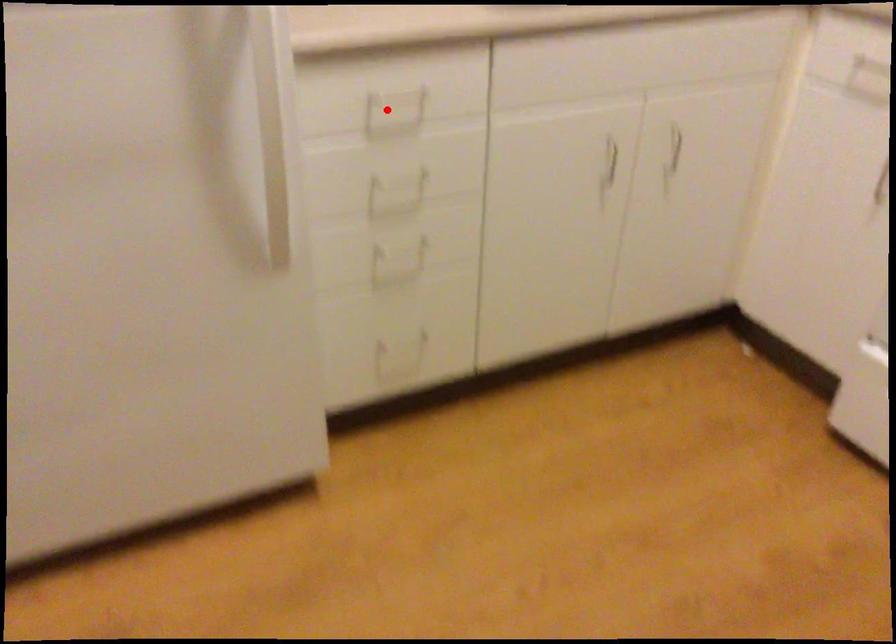
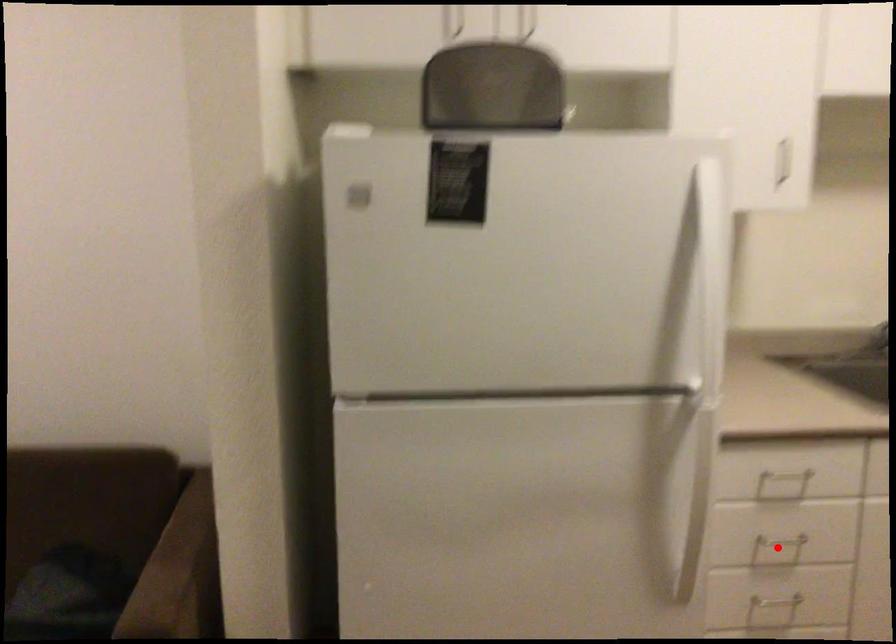
I am providing you with two images of the same scene from different viewpoints. A red point is marked on the first image and another point is marked on the second image. Do the highlighted points in image1 and image2 indicate the same real-world spot?

No